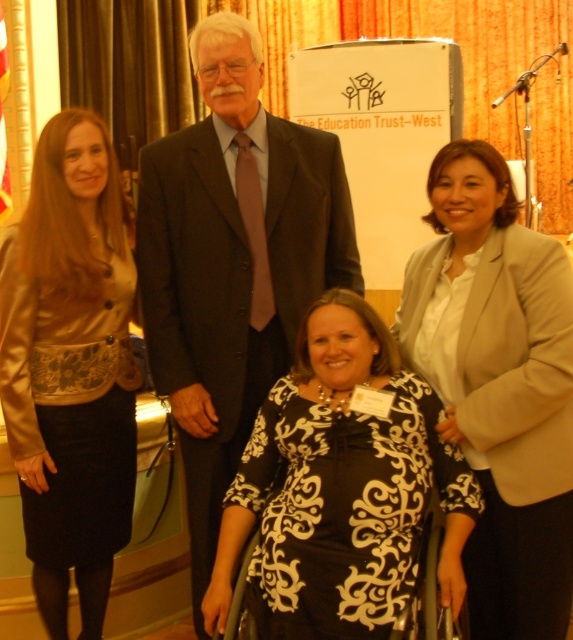
Who is more forward, (414, 540) or (458, 554)?

Point (414, 540) is in front.

Does black printed dress at center have a smaller size compared to metallic silver wheelchair at center?

Incorrect, black printed dress at center is not smaller in size than metallic silver wheelchair at center.

Who is more distant from viewer, (268, 484) or (211, 612)?

The point (268, 484) is behind.

At what (x,y) coordinates should I click in order to perform the action: click on black printed dress at center. Please return your answer as a coordinate pair (x, y). The height and width of the screenshot is (640, 573). Looking at the image, I should click on (340, 488).

Is satin gold jacket at left taller than metallic silver wheelchair at center?

Yes, satin gold jacket at left is taller than metallic silver wheelchair at center.

Between point (88, 232) and point (441, 572), which one is positioned in front?

Point (441, 572) is in front.

Locate an element on the screen. Image resolution: width=573 pixels, height=640 pixels. satin gold jacket at left is located at coordinates (70, 368).

Between black printed dress at center and satin gold jacket at left, which one is positioned lower?

Positioned lower is black printed dress at center.

Where is `black printed dress at center`? The image size is (573, 640). black printed dress at center is located at coordinates (340, 488).